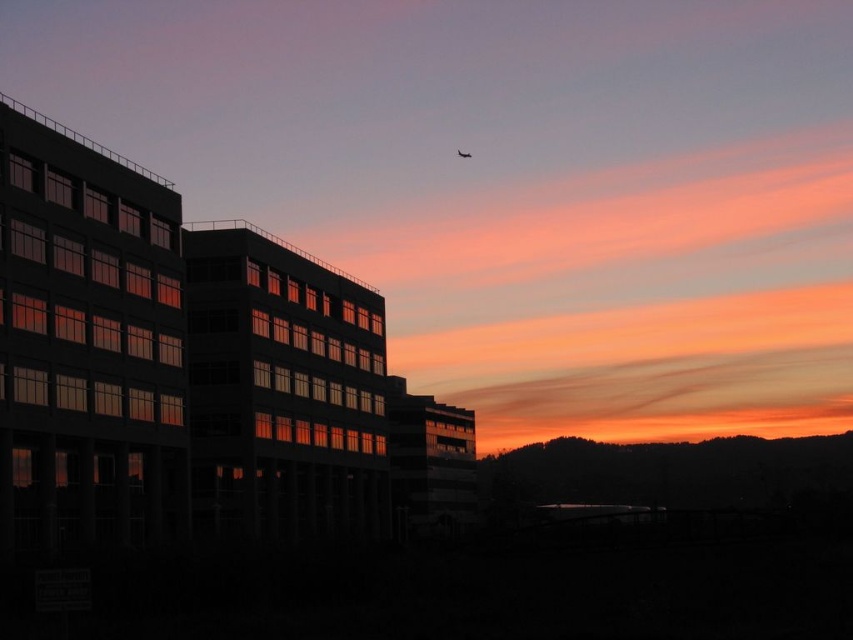
Looking at this image, you are standing in an open space and want to take a photo of the matte glass building at left. If your camera has a maximum zoom range of 100 meters, will you be able to capture the entire building without moving closer?

The distance between the matte glass building at left and the viewer is 362.53 meters. Since your camera can only zoom up to 100 meters, you won

You are standing in the middle of the city and looking at the sunset. You see the matte glass building at left and the translucent glass airplane at upper center. Which object is closer to you based on their positions in the image?

The matte glass building at left is closer to you because it is in front of the translucent glass airplane at upper center, which is further away.

You are an architect analyzing the sunset scene. You observe the matte glass building at left and the translucent glass airplane at upper center. Which object casts a longer shadow on the ground?

The matte glass building at left is taller than the translucent glass airplane at upper center, so it would cast a longer shadow on the ground.